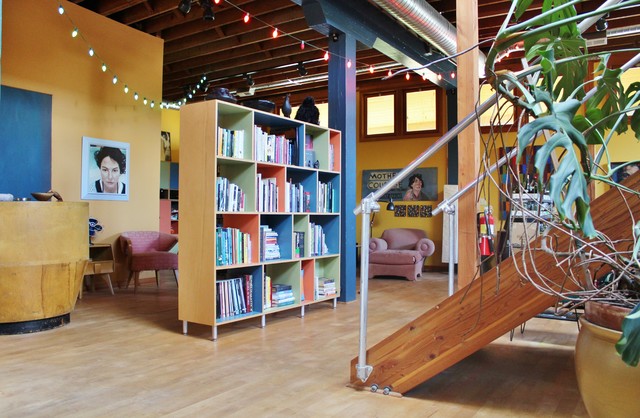
Image resolution: width=640 pixels, height=418 pixels. Find the location of `large yellow plant vase`. large yellow plant vase is located at coordinates (602, 360).